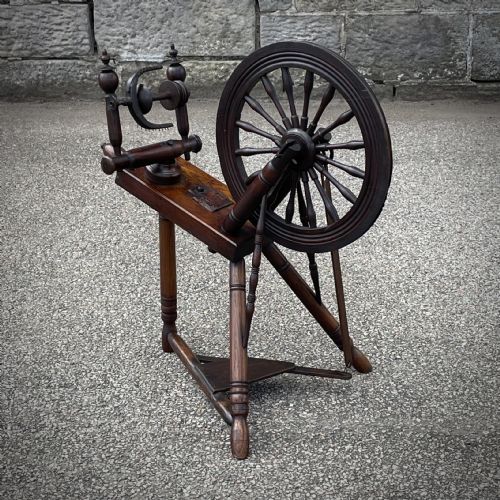
This screenshot has width=500, height=500. Identify the location of wooden crossbar support. (218, 401).